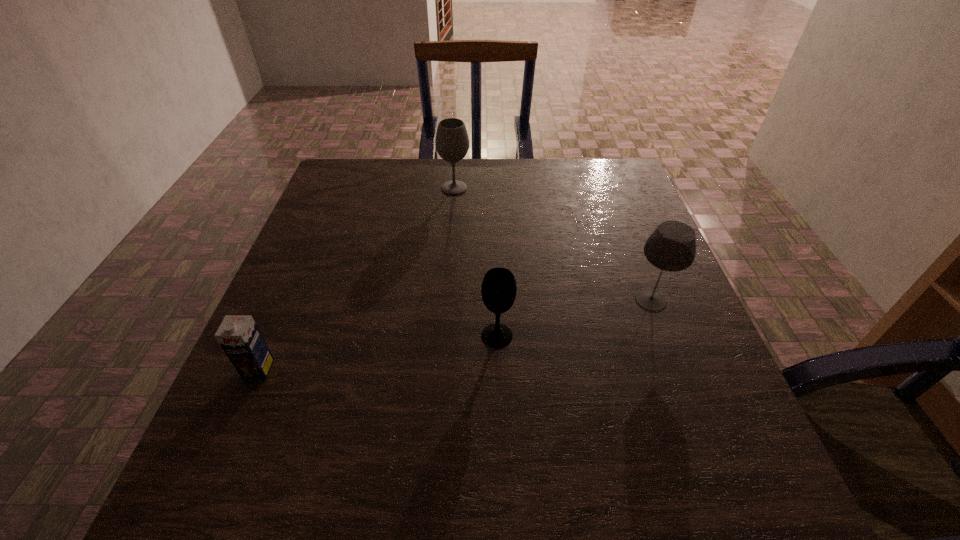
Identify which object is located as the second nearest to the second wineglass from right to left. Please provide its 2D coordinates. Your answer should be formatted as a tuple, i.e. [(x, y)], where the tuple contains the x and y coordinates of a point satisfying the conditions above.

[(238, 335)]

At what (x,y) coordinates should I click in order to perform the action: click on object that is the second closest to the chocolate milk. Please return your answer as a coordinate pair (x, y). This screenshot has height=540, width=960. Looking at the image, I should click on (452, 142).

Locate an element on the screen. This screenshot has height=540, width=960. wineglass object that ranks as the second closest to the third nearest object is located at coordinates (452, 142).

Image resolution: width=960 pixels, height=540 pixels. I want to click on wineglass that is the second closest one to the chocolate milk, so click(452, 142).

Where is `vacant space that satisfies the following two spatial constraints: 1. on the front side of the farthest wineglass; 2. on the left side of the third object from left to right`? vacant space that satisfies the following two spatial constraints: 1. on the front side of the farthest wineglass; 2. on the left side of the third object from left to right is located at coordinates (444, 335).